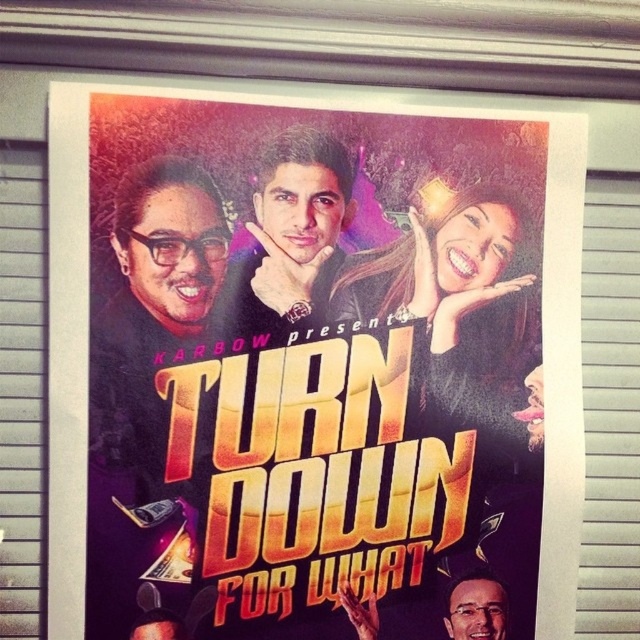
Between black matte hair at upper center and smooth skin face at center, which one appears on the left side from the viewer's perspective?

smooth skin face at center

Can you confirm if black matte hair at upper center is thinner than smooth skin face at center?

No, black matte hair at upper center is not thinner than smooth skin face at center.

Looking at this image, who is more distant from viewer, (x=518, y=273) or (x=241, y=268)?

The point (x=518, y=273) is behind.

Where is `black matte hair at upper center`? black matte hair at upper center is located at coordinates (458, 310).

Is black matte hair at upper center positioned behind smooth skin face at lower right?

No, it is in front of smooth skin face at lower right.

Can you confirm if black matte hair at upper center is thinner than smooth skin face at lower right?

No.

Who is more distant from viewer, (413, 388) or (458, 609)?

Point (458, 609)

Find the location of a particular element. black matte hair at upper center is located at coordinates (458, 310).

Is vibrant paper poster at center taller than smooth skin face at lower right?

Correct, vibrant paper poster at center is much taller as smooth skin face at lower right.

Does vibrant paper poster at center lie in front of smooth skin face at lower right?

Answer: Yes.

Between point (368, 387) and point (490, 628), which one is positioned in front?

Point (368, 387) is more forward.

Identify the location of vibrant paper poster at center. The width and height of the screenshot is (640, 640). (308, 365).